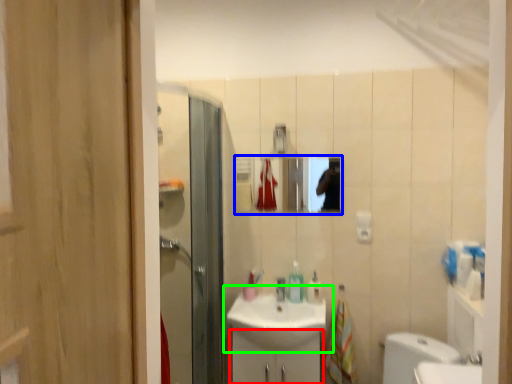
Question: Estimate the real-world distances between objects in this image. Which object is closer to bathroom cabinet (highlighted by a red box), mirror (highlighted by a blue box) or sink (highlighted by a green box)?

Choices:
 (A) mirror
 (B) sink

Answer: (B)